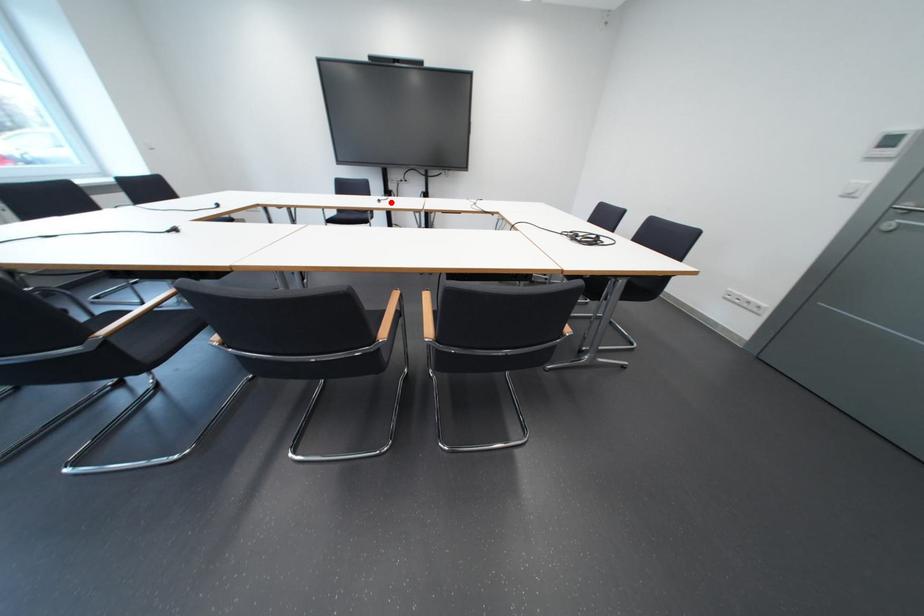
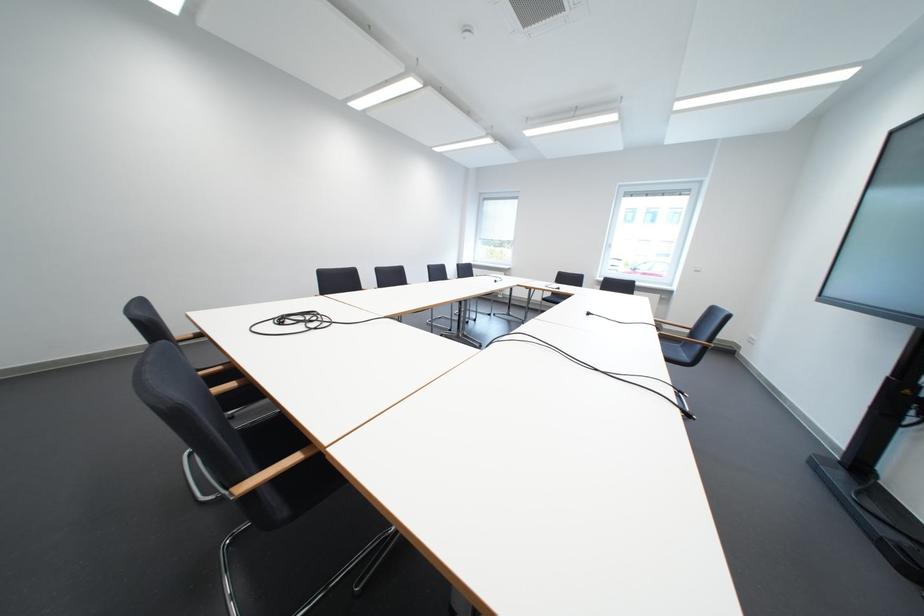
Where in the second image is the point corresponding to the highlighted location from the first image?

(601, 315)